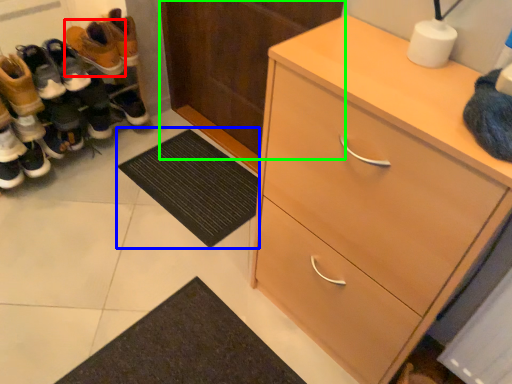
Question: Which object is positioned farthest from footwear (highlighted by a red box)? Select from doormat (highlighted by a blue box) and door (highlighted by a green box).

Choices:
 (A) doormat
 (B) door

Answer: (A)